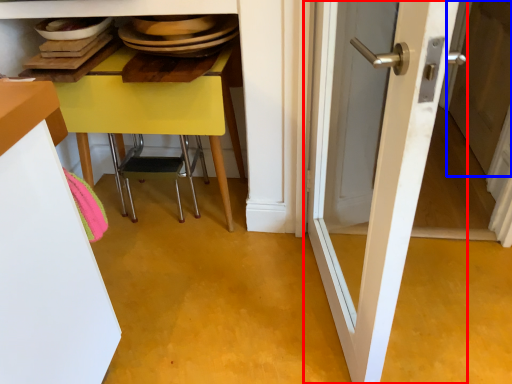
Question: Which of the following is the farthest to the observer, door (highlighted by a red box) or screen door (highlighted by a blue box)?

Choices:
 (A) door
 (B) screen door

Answer: (B)